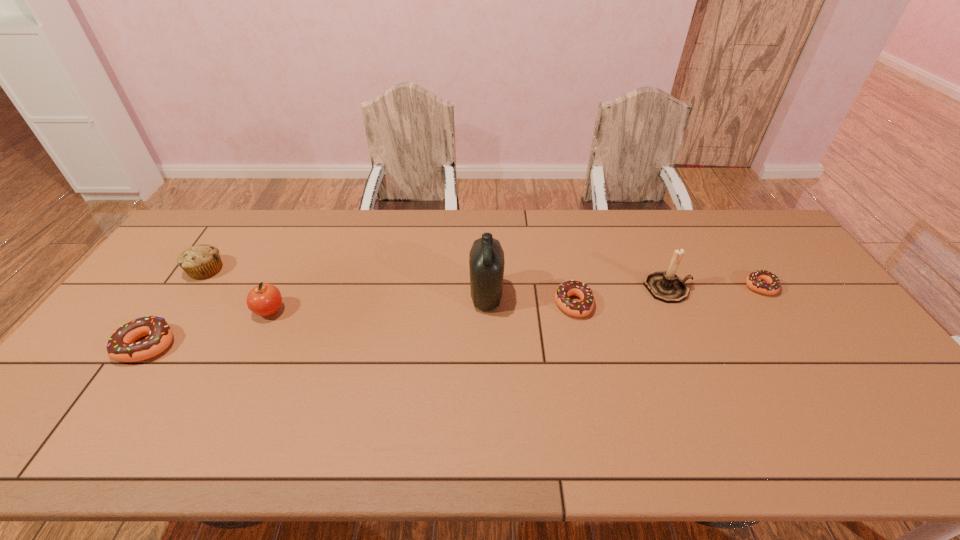
This screenshot has height=540, width=960. Find the location of `the fifth tallest object`. the fifth tallest object is located at coordinates [x=121, y=346].

This screenshot has width=960, height=540. What are the coordinates of `the nearest object` in the screenshot? It's located at (121, 346).

Image resolution: width=960 pixels, height=540 pixels. What are the coordinates of `the second doughnut from right to left` in the screenshot? It's located at (569, 288).

Locate an element on the screen. The width and height of the screenshot is (960, 540). the third object from right to left is located at coordinates (569, 288).

You are a GUI agent. You are given a task and a screenshot of the screen. Output one action in this format:
    pyautogui.click(x=<x>, y=<y>)
    Task: Click on the rightmost object
    
    Given the screenshot: What is the action you would take?
    pyautogui.click(x=764, y=282)

At what (x,y) coordinates should I click in order to perform the action: click on the shortest object. Please return your answer as a coordinate pair (x, y). Looking at the image, I should click on (764, 282).

Where is `muffin`? muffin is located at coordinates (202, 261).

At what (x,y) coordinates should I click in order to perform the action: click on the tallest object. Please return your answer as a coordinate pair (x, y). The width and height of the screenshot is (960, 540). Looking at the image, I should click on (486, 259).

Find the location of a particular element. The height and width of the screenshot is (540, 960). the fourth object from left to right is located at coordinates click(x=486, y=259).

Image resolution: width=960 pixels, height=540 pixels. I want to click on apple, so click(x=265, y=300).